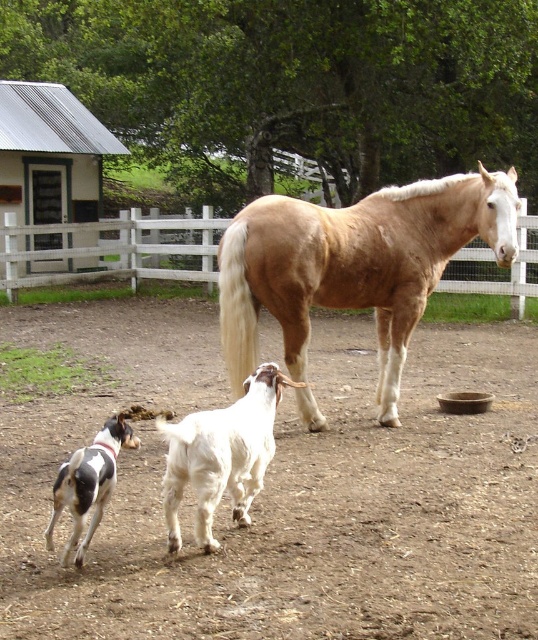
Looking at this image, you are standing at the point labeled point (284, 490) in the image. What is the type of terrain you are currently standing on?

The point labeled point (284, 490) corresponds to the brown dirt field at center, so you are standing on a dirt field.

You are a visitor at a farm and want to take a photo of the white wooden fence at center and the white fur dog at lower left. Based on their positions, which object is closer to the left side of the image?

The white fur dog at lower left is more on the left side of the image than the white wooden fence at center because the white wooden fence at center is positioned on the left side of white fur dog at lower left.